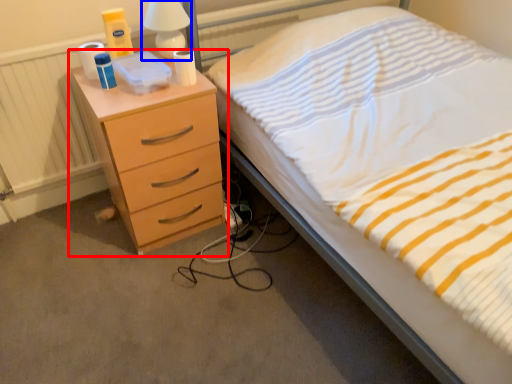
Question: Which point is further to the camera, chest of drawers (highlighted by a red box) or bedside lamp (highlighted by a blue box)?

Choices:
 (A) chest of drawers
 (B) bedside lamp

Answer: (B)